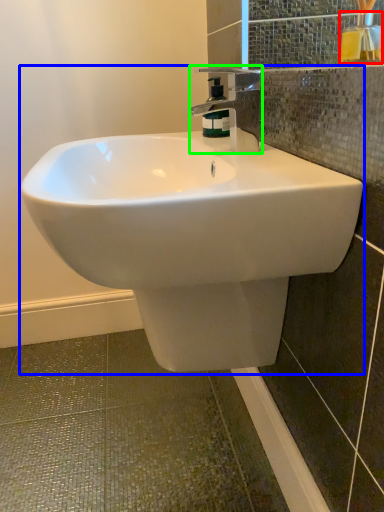
Question: Which object is positioned closest to mouthwash (highlighted by a red box)? Select from sink (highlighted by a blue box) and tap (highlighted by a green box).

Choices:
 (A) sink
 (B) tap

Answer: (B)